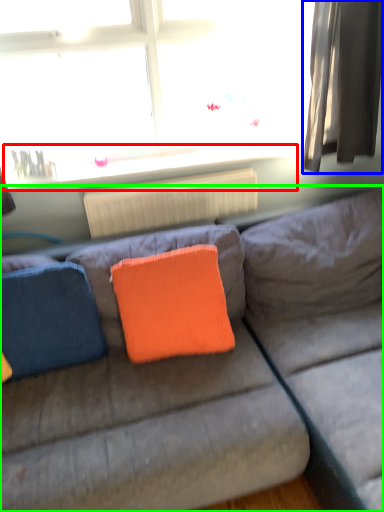
Question: Which object is the closest to the window sill (highlighted by a red box)? Choose among these: curtain (highlighted by a blue box) or studio couch (highlighted by a green box).

Choices:
 (A) curtain
 (B) studio couch

Answer: (A)